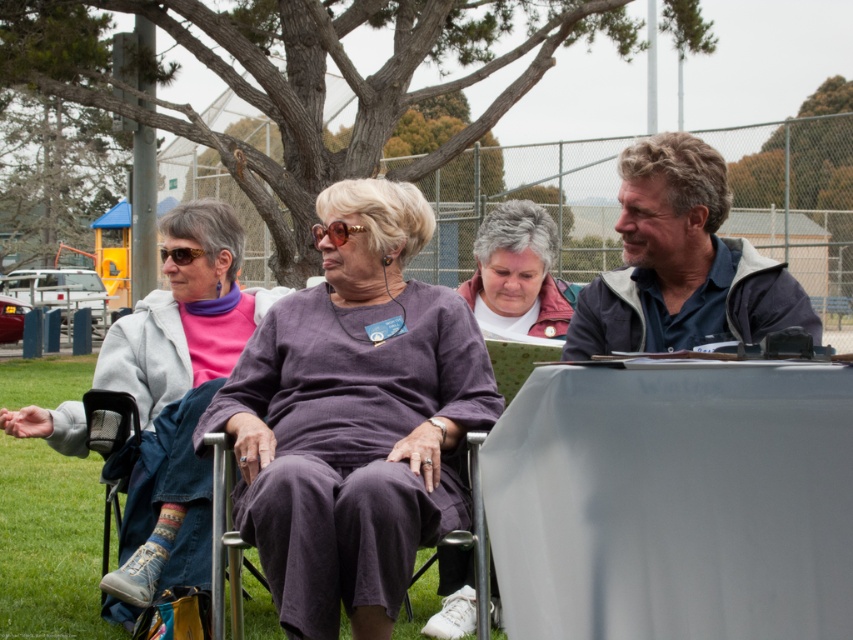
Question: Is the position of purple fabric shirt at center less distant than that of white cotton shirt at center?

Choices:
 (A) yes
 (B) no

Answer: (A)

Question: Among these objects, which one is nearest to the camera?

Choices:
 (A) purple fabric shirt at center
 (B) white matte jacket at center
 (C) white cotton shirt at center
 (D) matte gray jacket at center

Answer: (A)

Question: Which point is farther to the camera?

Choices:
 (A) (724, 276)
 (B) (554, 307)

Answer: (B)

Question: Can you confirm if blue fabric jacket at center is positioned above purple fabric chair at center?

Choices:
 (A) no
 (B) yes

Answer: (B)

Question: Which object is positioned farthest from the purple fabric shirt at center?

Choices:
 (A) purple fabric chair at center
 (B) matte gray jacket at center
 (C) white cotton shirt at center
 (D) white matte jacket at center

Answer: (D)

Question: Can you confirm if matte gray jacket at center is positioned to the right of blue fabric jacket at center?

Choices:
 (A) no
 (B) yes

Answer: (A)